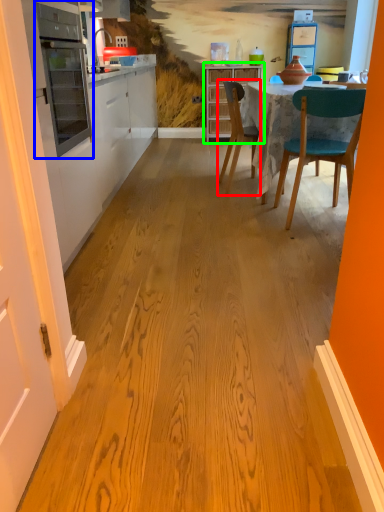
Question: Which is nearer to the chair (highlighted by a red box)? appliance (highlighted by a blue box) or cabinetry (highlighted by a green box).

Choices:
 (A) appliance
 (B) cabinetry

Answer: (A)